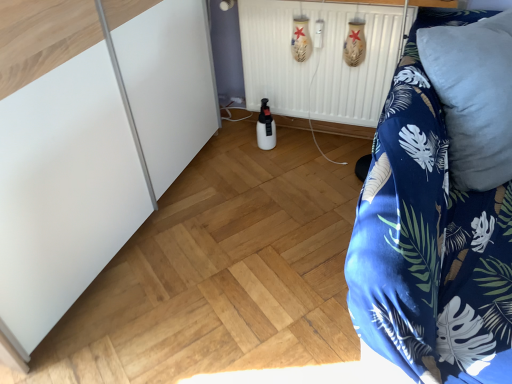
Where is `white matte bottle at center`? This screenshot has width=512, height=384. white matte bottle at center is located at coordinates (266, 127).

The image size is (512, 384). Describe the element at coordinates (319, 60) in the screenshot. I see `white matte radiator at center` at that location.

The width and height of the screenshot is (512, 384). In order to click on white matte bottle at center in this screenshot , I will do `click(266, 127)`.

From the image's perspective, which is above, blue soft pillow at right or white matte radiator at center?

white matte radiator at center.

Is blue soft pillow at right taller or shorter than white matte radiator at center?

Clearly, blue soft pillow at right is taller compared to white matte radiator at center.

Which of these two, blue soft pillow at right or white matte radiator at center, is bigger?

Bigger between the two is blue soft pillow at right.

Between blue floral fabric at right and white matte bottle at center, which one has larger size?

blue floral fabric at right is bigger.

Considering the sizes of objects blue floral fabric at right and white matte bottle at center in the image provided, who is taller, blue floral fabric at right or white matte bottle at center?

With more height is blue floral fabric at right.

Measure the distance between blue floral fabric at right and white matte bottle at center.

They are 4.08 feet apart.

From the image's perspective, which is above, blue floral fabric at right or white matte bottle at center?

From the image's view, white matte bottle at center is above.

In the scene shown: Is blue floral fabric at right far away from white matte radiator at center?

blue floral fabric at right is actually quite close to white matte radiator at center.

From the image's perspective, is blue floral fabric at right on top of white matte radiator at center?

No, from the image's perspective, blue floral fabric at right is not over white matte radiator at center.

Which object is further away from the camera, blue floral fabric at right or white matte radiator at center?

white matte radiator at center is behind.

At what (x,y) coordinates should I click in order to perform the action: click on furniture on the right of white matte radiator at center. Please return your answer as a coordinate pair (x, y). This screenshot has width=512, height=384. Looking at the image, I should click on (430, 240).

Considering the points (269, 118) and (502, 19), which point is in front, point (269, 118) or point (502, 19)?

The point (502, 19) is closer.

Which of these two, white matte bottle at center or blue soft pillow at right, stands shorter?

With less height is white matte bottle at center.

Between white matte bottle at center and blue soft pillow at right, which one has larger width?

blue soft pillow at right is wider.

Is white matte bottle at center touching blue soft pillow at right?

No, white matte bottle at center is not with blue soft pillow at right.

Is white matte bottle at center turned away from blue floral fabric at right?

No, blue floral fabric at right is not at the back of white matte bottle at center.

Do you think white matte bottle at center is within blue floral fabric at right, or outside of it?

white matte bottle at center is located beyond the bounds of blue floral fabric at right.

Can you tell me how much white matte bottle at center and blue floral fabric at right differ in facing direction?

89.7 degrees.

Is white matte bottle at center facing away from white matte radiator at center?

Yes, white matte bottle at center is positioned with its back facing white matte radiator at center.

Is white matte bottle at center not close to white matte radiator at center?

Actually, white matte bottle at center and white matte radiator at center are a little close together.

Is white matte bottle at center further to camera compared to white matte radiator at center?

Yes, white matte bottle at center is further from the viewer.

Choose the correct answer: Is white matte bottle at center inside white matte radiator at center or outside it?

white matte bottle at center is not enclosed by white matte radiator at center.

Considering the positions of points (264, 26) and (270, 132), is point (264, 26) closer to camera compared to point (270, 132)?

Yes, it is in front of point (270, 132).

Locate an element on the screen. Image resolution: width=512 pixels, height=384 pixels. radiator in front of the white matte bottle at center is located at coordinates (319, 60).

Is white matte radiator at center placed right next to white matte bottle at center?

white matte radiator at center and white matte bottle at center are clearly separated.

Is white matte radiator at center oriented towards white matte bottle at center?

Yes, white matte radiator at center is oriented towards white matte bottle at center.

At what (x,y) coordinates should I click in order to perform the action: click on pillow positioned vertically above the white matte radiator at center (from a real-world perspective). Please return your answer as a coordinate pair (x, y). Looking at the image, I should click on (474, 96).

Locate an element on the screen. furniture below the white matte bottle at center (from the image's perspective) is located at coordinates (430, 240).

Which object lies further to the anchor point blue floral fabric at right, white matte radiator at center or blue soft pillow at right?

white matte radiator at center lies further to blue floral fabric at right than the other object.

From the image, which object appears to be farther from white matte bottle at center, blue floral fabric at right or blue soft pillow at right?

blue floral fabric at right.

Based on their spatial positions, is white matte bottle at center or blue soft pillow at right further from white matte radiator at center?

blue soft pillow at right.

Looking at the image, which one is located further to blue soft pillow at right, white matte bottle at center or blue floral fabric at right?

white matte bottle at center is further to blue soft pillow at right.

Estimate the real-world distances between objects in this image. Which object is closer to white matte bottle at center, blue floral fabric at right or white matte radiator at center?

Among the two, white matte radiator at center is located nearer to white matte bottle at center.

Estimate the real-world distances between objects in this image. Which object is further from white matte bottle at center, blue soft pillow at right or white matte radiator at center?

blue soft pillow at right is positioned further to the anchor white matte bottle at center.

Based on their spatial positions, is white matte bottle at center or blue soft pillow at right further from blue floral fabric at right?

white matte bottle at center is further to blue floral fabric at right.

Consider the image. Estimate the real-world distances between objects in this image. Which object is closer to blue soft pillow at right, blue floral fabric at right or white matte radiator at center?

Among the two, blue floral fabric at right is located nearer to blue soft pillow at right.

Find the location of a particular element. radiator positioned between blue soft pillow at right and white matte bottle at center from near to far is located at coordinates coord(319,60).

The image size is (512, 384). I want to click on pillow between blue floral fabric at right and white matte bottle at center along the z-axis, so click(474, 96).

At what (x,y) coordinates should I click in order to perform the action: click on radiator between blue floral fabric at right and white matte bottle at center along the z-axis. Please return your answer as a coordinate pair (x, y). This screenshot has height=384, width=512. Looking at the image, I should click on (319, 60).

Locate an element on the screen. pillow between blue floral fabric at right and white matte radiator at center along the z-axis is located at coordinates (474, 96).